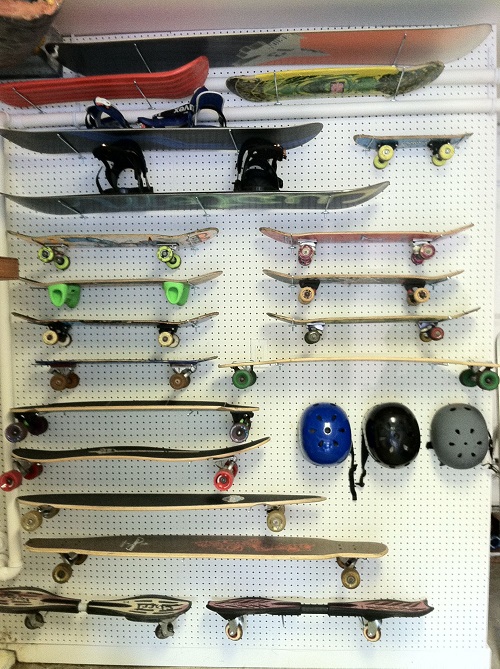
What are the coordinates of `pinboard` in the screenshot? It's located at (427, 508).